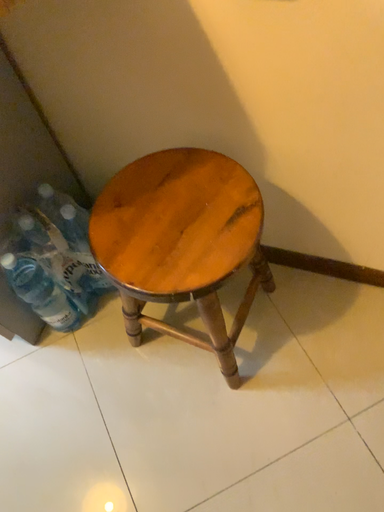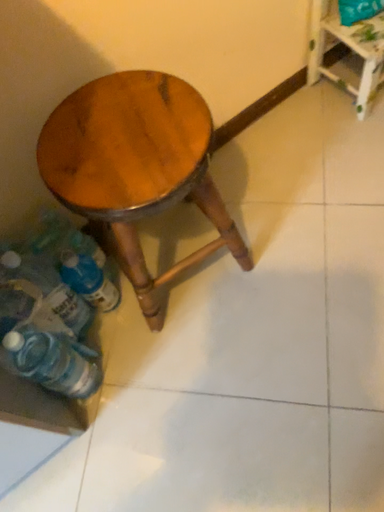
Question: How did the camera likely rotate when shooting the video?

Choices:
 (A) rotated downward
 (B) rotated upward

Answer: (B)